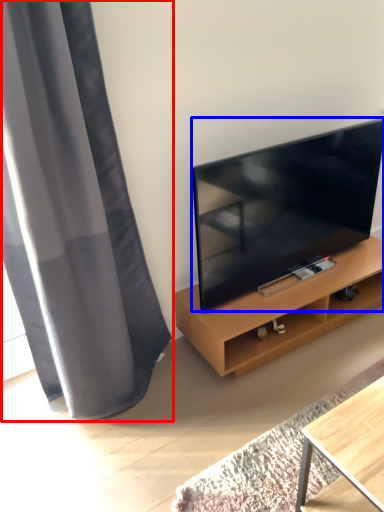
Question: Among these objects, which one is farthest to the camera, curtain (highlighted by a red box) or television (highlighted by a blue box)?

Choices:
 (A) curtain
 (B) television

Answer: (B)